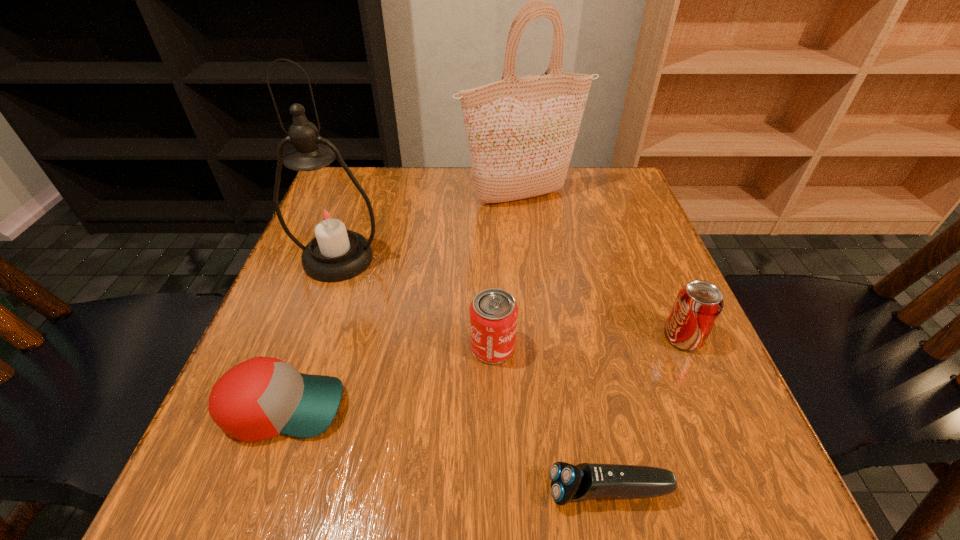
Locate an element on the screen. the second closest object relative to the can is located at coordinates (263, 397).

Identify which object is the second closest to the second shortest object. Please provide its 2D coordinates. Your answer should be formatted as a tuple, i.e. [(x, y)], where the tuple contains the x and y coordinates of a point satisfying the conditions above.

[(325, 214)]

The width and height of the screenshot is (960, 540). I want to click on free spot that satisfies the following two spatial constraints: 1. on the front side of the oil lamp; 2. on the left side of the can, so click(306, 347).

The height and width of the screenshot is (540, 960). Find the location of `vacant space that satisfies the following two spatial constraints: 1. on the front side of the oil lamp; 2. at the brim of the second shortest object`. vacant space that satisfies the following two spatial constraints: 1. on the front side of the oil lamp; 2. at the brim of the second shortest object is located at coordinates (285, 407).